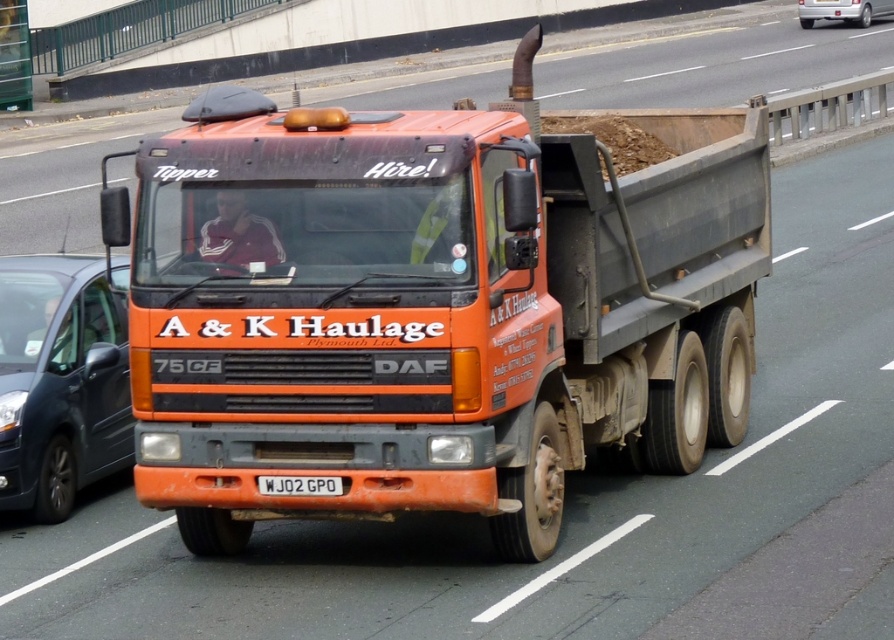
Identify the location of matte black van at left. click(x=60, y=380).

Is matte black van at left wider than silver metallic sedan at upper right?

Incorrect, matte black van at left's width does not surpass silver metallic sedan at upper right's.

Which is in front, point (72, 275) or point (852, 8)?

Positioned in front is point (72, 275).

Find the location of a particular element. The image size is (894, 640). matte black van at left is located at coordinates (60, 380).

Which is more to the left, orange matte truck at center or matte black van at left?

From the viewer's perspective, matte black van at left appears more on the left side.

Find the location of a particular element. orange matte truck at center is located at coordinates (434, 307).

Between silver metallic sedan at upper right and white plastic license plate at center, which one has less height?

white plastic license plate at center is shorter.

Is silver metallic sedan at upper right wider than white plastic license plate at center?

Indeed, silver metallic sedan at upper right has a greater width compared to white plastic license plate at center.

Who is more forward, (883,13) or (283,483)?

Positioned in front is point (283,483).

Find the location of `silver metallic sedan at upper right`. silver metallic sedan at upper right is located at coordinates (842, 10).